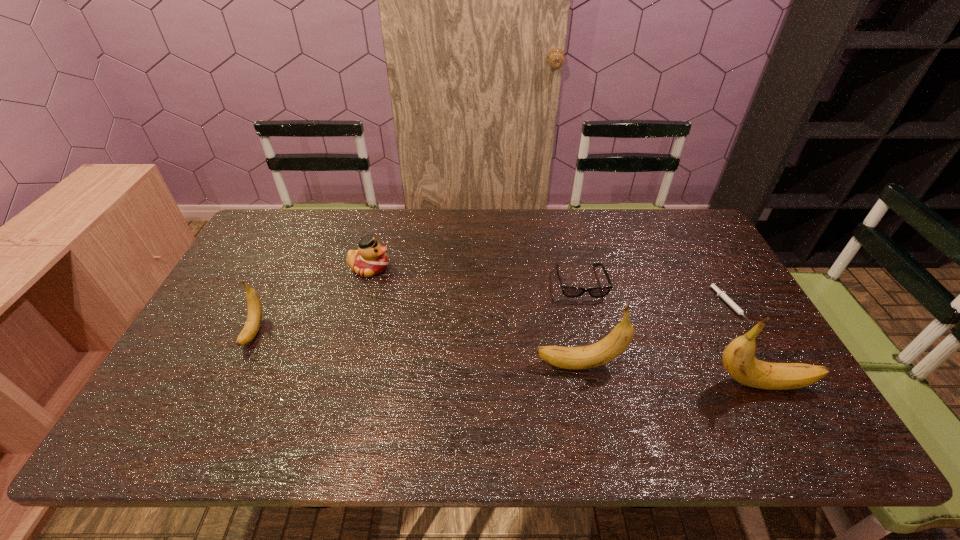
Locate an element on the screen. empty location between the spectacles and the rightmost banana is located at coordinates (670, 333).

Find the location of `vacant space that's between the syringe and the second banana from left to right`. vacant space that's between the syringe and the second banana from left to right is located at coordinates (654, 335).

Where is `free space that is in between the syringe and the second shortest object`? The height and width of the screenshot is (540, 960). free space that is in between the syringe and the second shortest object is located at coordinates (655, 294).

Where is `object that ranks as the closest to the rightmost banana`? The image size is (960, 540). object that ranks as the closest to the rightmost banana is located at coordinates (732, 304).

This screenshot has height=540, width=960. I want to click on object that ranks as the fourth closest to the rightmost banana, so click(370, 259).

This screenshot has height=540, width=960. Find the location of `banana that is the closest one to the syringe`. banana that is the closest one to the syringe is located at coordinates (738, 358).

Locate an element on the screen. The image size is (960, 540). banana that stands as the closest to the syringe is located at coordinates (738, 358).

You are a GUI agent. You are given a task and a screenshot of the screen. Output one action in this format:
    pyautogui.click(x=<x>, y=<y>)
    Task: Click on the free space that satisfies the following two spatial constraints: 1. on the lenses of the second shortest object; 2. at the start of the peel on the second shortest banana
    Image resolution: width=960 pixels, height=540 pixels.
    Given the screenshot: What is the action you would take?
    pyautogui.click(x=600, y=365)

Identify the location of vacant position in the image that satisfies the following two spatial constraints: 1. on the face of the fourth tallest object; 2. on the right side of the shortest object. This screenshot has height=540, width=960. coord(359,306).

What are the coordinates of `free point that satisfies the following two spatial constraints: 1. on the front side of the shortest object; 2. at the start of the peel on the second tallest banana` in the screenshot? It's located at (763, 365).